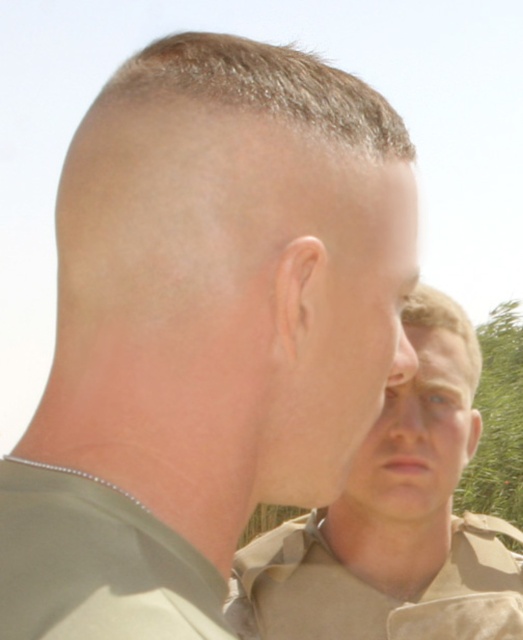
Question: Is tan uniform at center thinner than tan/cotton shirt at center?

Choices:
 (A) yes
 (B) no

Answer: (B)

Question: Among these objects, which one is farthest from the camera?

Choices:
 (A) tan uniform at center
 (B) tan/cotton shirt at center

Answer: (B)

Question: Can you confirm if tan uniform at center is smaller than tan/cotton shirt at center?

Choices:
 (A) yes
 (B) no

Answer: (B)

Question: Is tan uniform at center bigger than tan/cotton shirt at center?

Choices:
 (A) no
 (B) yes

Answer: (B)

Question: Among these objects, which one is nearest to the camera?

Choices:
 (A) tan uniform at center
 (B) tan/cotton shirt at center

Answer: (A)